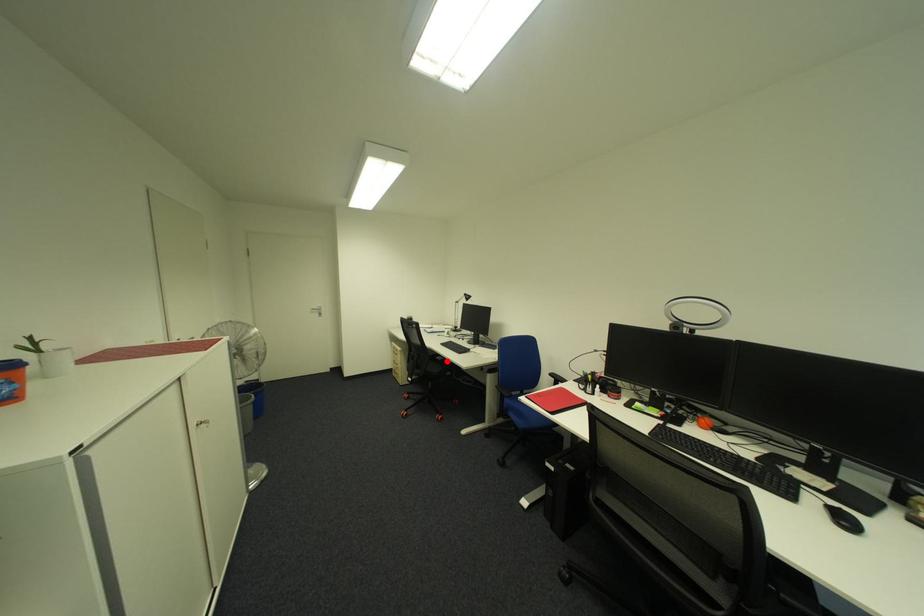
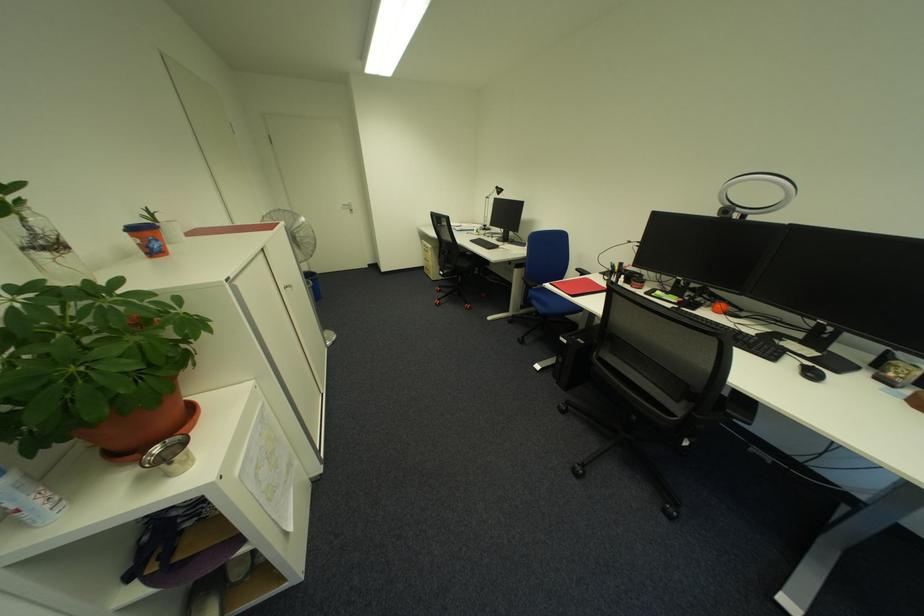
Find the pixel in the second image that matches the highlighted location in the first image.

(477, 256)